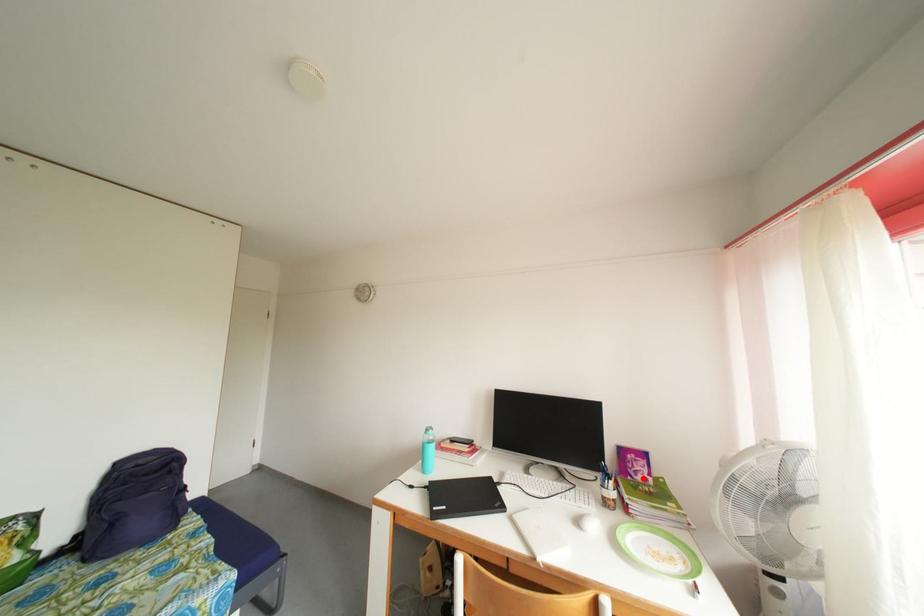
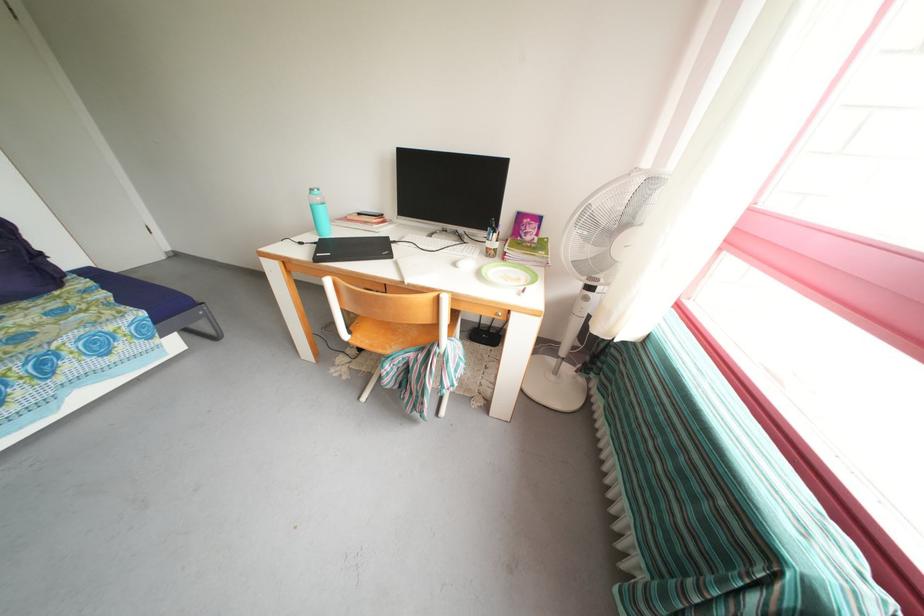
Question: I am providing you with two images of the same scene from different viewpoints. In image1, a red point is highlighted. Considering the same 3D point in image2, which of the following is correct?

Choices:
 (A) It is closer
 (B) It is farther

Answer: (A)